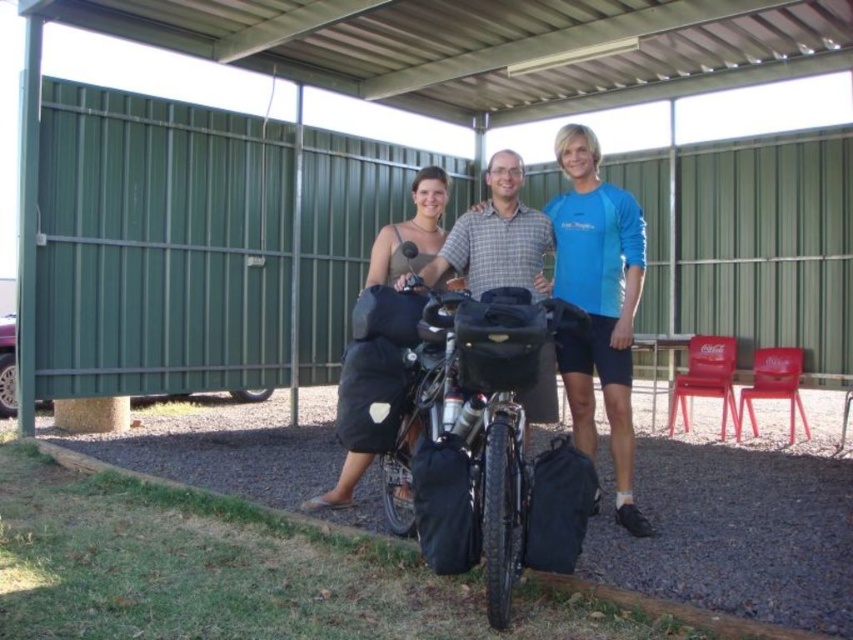
Question: Which point is closer to the camera?

Choices:
 (A) (549, 353)
 (B) (413, 403)
 (C) (363, 456)

Answer: (B)

Question: Can you confirm if black matte bicycle at center is wider than matte black tank top at center?

Choices:
 (A) no
 (B) yes

Answer: (A)

Question: Is matte black bicycle at center above matte black tank top at center?

Choices:
 (A) no
 (B) yes

Answer: (A)

Question: Is matte plaid shirt at center closer to the viewer compared to matte black tank top at center?

Choices:
 (A) no
 (B) yes

Answer: (B)

Question: Among these objects, which one is farthest from the camera?

Choices:
 (A) matte black bicycle at center
 (B) black matte bicycle at center
 (C) matte plaid shirt at center
 (D) matte black tank top at center

Answer: (D)

Question: Considering the real-world distances, which object is closest to the black matte bicycle at center?

Choices:
 (A) matte black tank top at center
 (B) matte black bicycle at center
 (C) matte plaid shirt at center

Answer: (C)